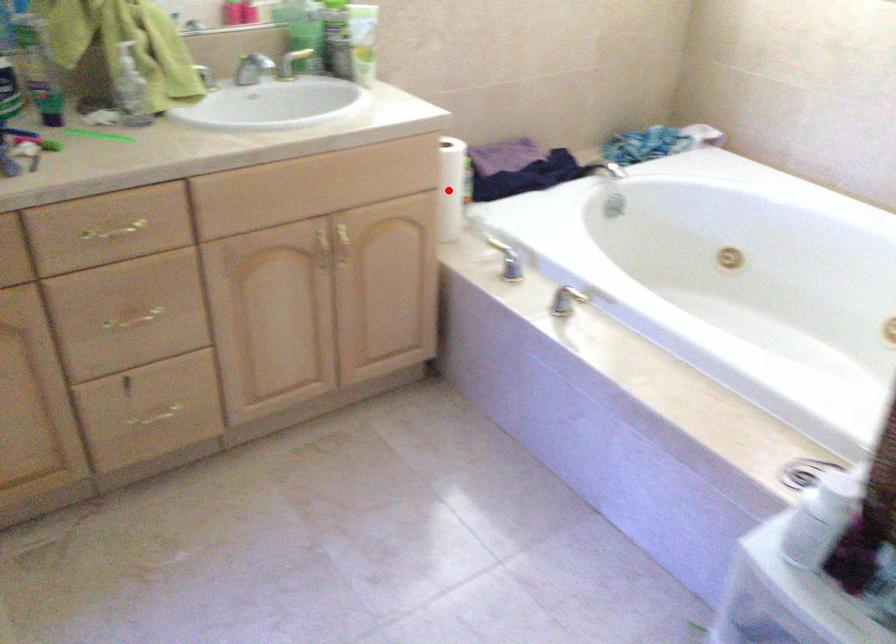
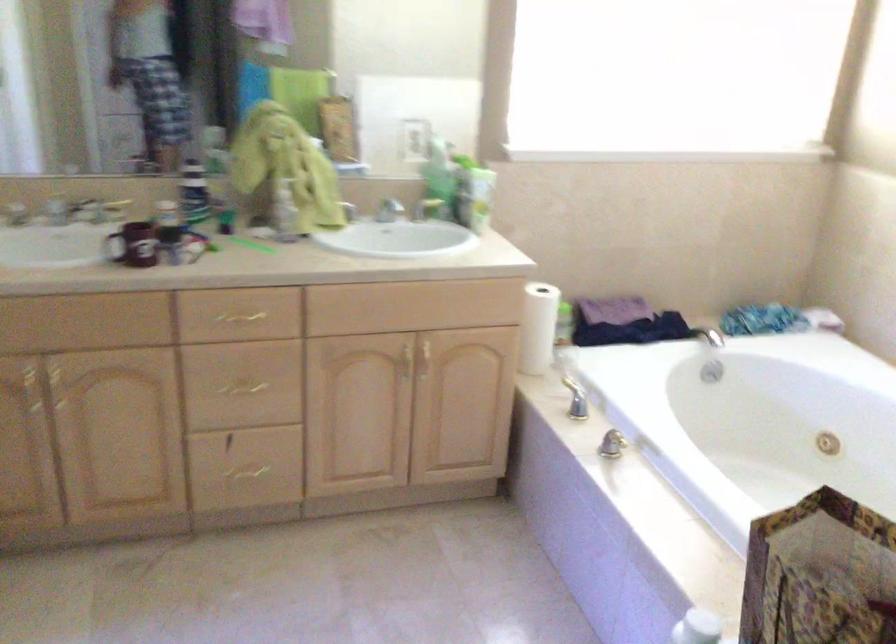
The point at the highlighted location is marked in the first image. Where is the corresponding point in the second image?

(538, 327)